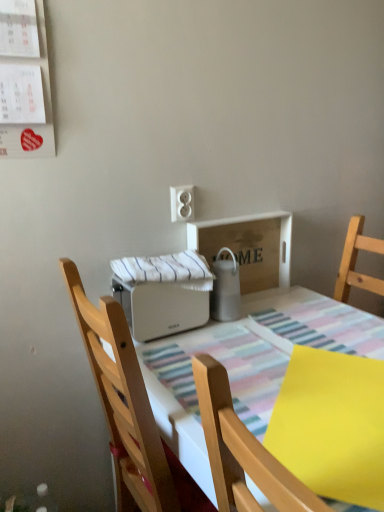
I want to click on vacant area situated to the left side of yellow matte paper at lower right, so click(x=227, y=386).